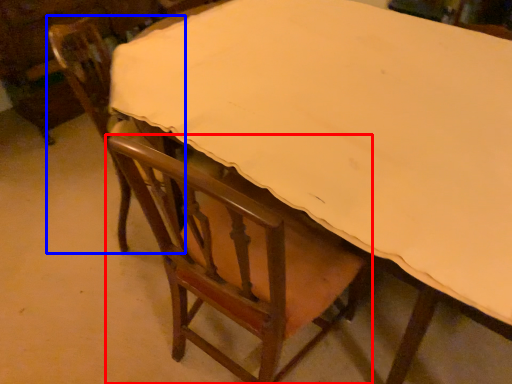
Question: Which point is further to the camera, chair (highlighted by a red box) or chair (highlighted by a blue box)?

Choices:
 (A) chair
 (B) chair

Answer: (B)